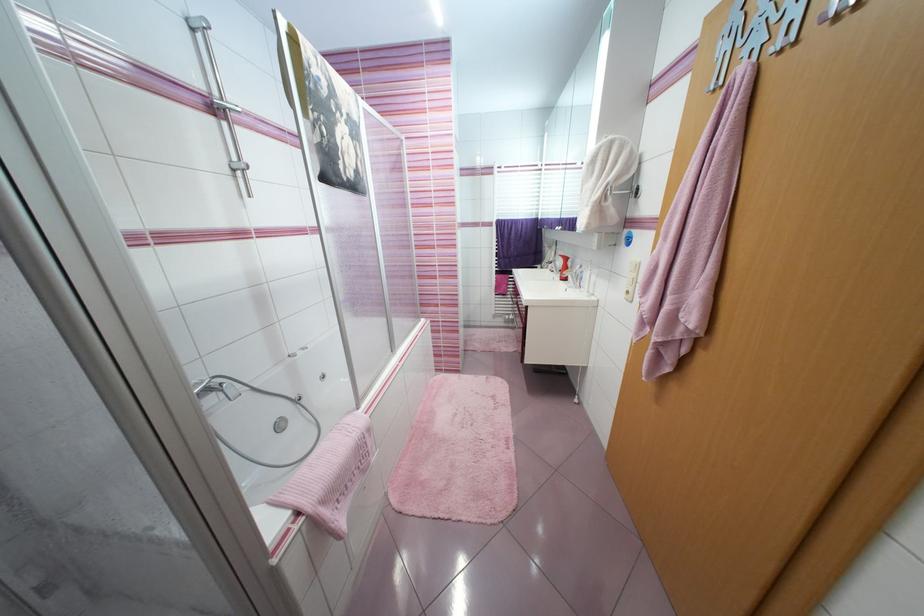
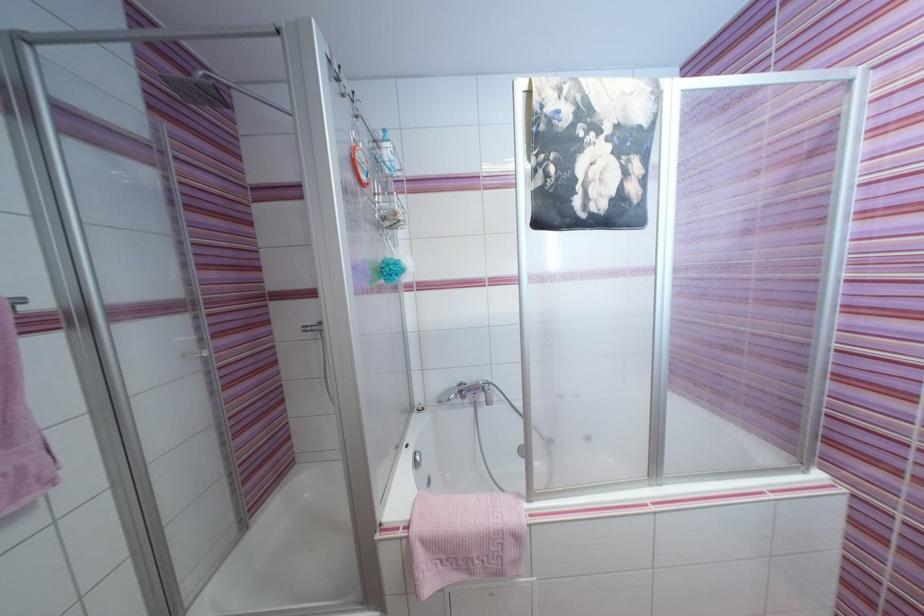
Find the pixel in the second image that matches point (373, 431) in the first image.

(521, 539)